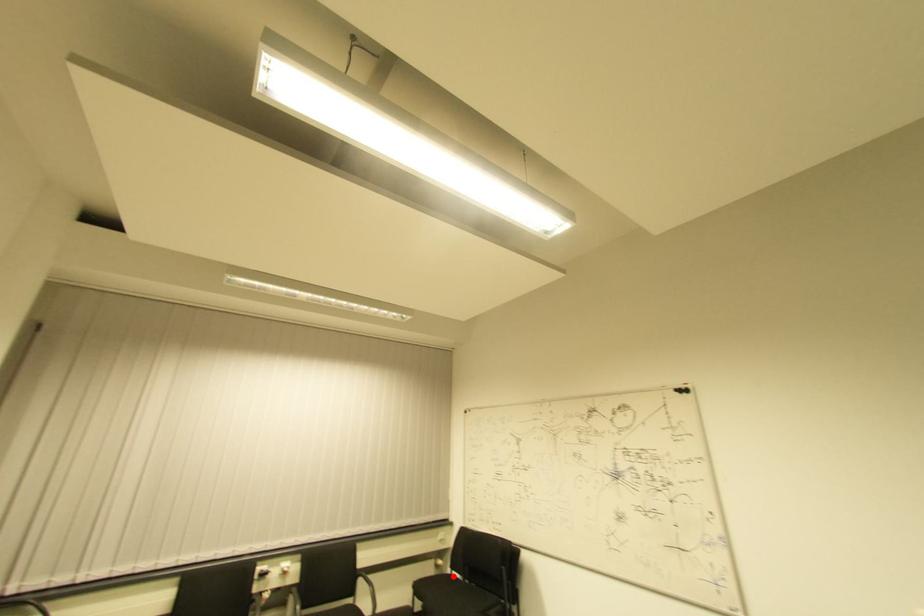
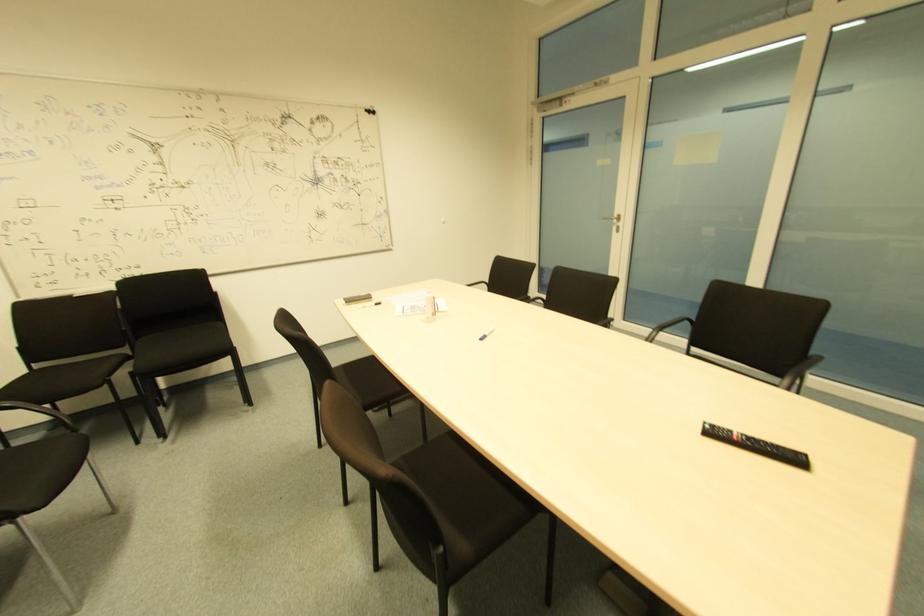
Locate, in the second image, the point that corresponds to the highlighted location in the first image.

(34, 370)